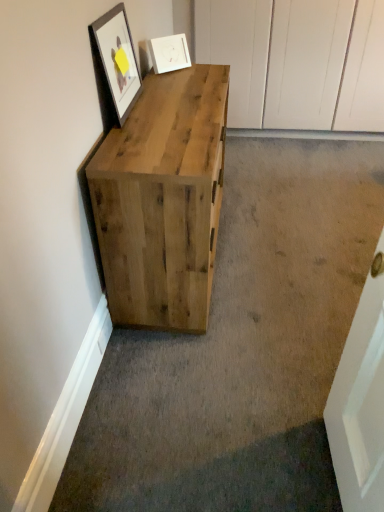
What do you see at coordinates (163, 200) in the screenshot? This screenshot has width=384, height=512. I see `natural wood chest of drawers at left` at bounding box center [163, 200].

Describe the element at coordinates (168, 53) in the screenshot. The height and width of the screenshot is (512, 384). I see `white matte picture frame at upper center, arranged as the second picture frame when viewed from the left` at that location.

At what (x,y) coordinates should I click in order to perform the action: click on white matte picture frame at upper center, the second picture frame when ordered from front to back. Please return your answer as a coordinate pair (x, y). This screenshot has width=384, height=512. Looking at the image, I should click on (168, 53).

Find the location of `natural wood chest of drawers at left`. natural wood chest of drawers at left is located at coordinates (163, 200).

Choose the correct answer: Is matte black frame at upper left, which ranks as the 2th picture frame in back-to-front order, inside white matte picture frame at upper center, the second picture frame when ordered from front to back, or outside it?

matte black frame at upper left, which ranks as the 2th picture frame in back-to-front order, is outside white matte picture frame at upper center, the second picture frame when ordered from front to back.

Is matte black frame at upper left, which ranks as the 2th picture frame in back-to-front order, positioned behind white matte picture frame at upper center, acting as the first picture frame starting from the back?

That is False.

Can you see matte black frame at upper left, which ranks as the 2th picture frame in back-to-front order, touching white matte picture frame at upper center, arranged as the second picture frame when viewed from the left?

No, matte black frame at upper left, which ranks as the 2th picture frame in back-to-front order, is not in contact with white matte picture frame at upper center, arranged as the second picture frame when viewed from the left.

Identify the location of picture frame above the matte black frame at upper left, which is counted as the first picture frame, starting from the front (from the image's perspective). (168, 53).

Measure the distance from white matte picture frame at upper center, which ranks as the 1th picture frame in right-to-left order, to natural wood chest of drawers at left.

The distance of white matte picture frame at upper center, which ranks as the 1th picture frame in right-to-left order, from natural wood chest of drawers at left is 66.08 centimeters.

Who is bigger, white matte picture frame at upper center, acting as the first picture frame starting from the back, or natural wood chest of drawers at left?

With larger size is natural wood chest of drawers at left.

Is white matte picture frame at upper center, arranged as the second picture frame when viewed from the left, to the left of natural wood chest of drawers at left from the viewer's perspective?

Yes, white matte picture frame at upper center, arranged as the second picture frame when viewed from the left, is to the left of natural wood chest of drawers at left.

Is point (157, 57) positioned in front of point (192, 239)?

No, (157, 57) is further to viewer.

Is matte black frame at upper left, which ranks as the 2th picture frame in back-to-front order, located within white matte picture frame at upper center, arranged as the second picture frame when viewed from the left?

Actually, matte black frame at upper left, which ranks as the 2th picture frame in back-to-front order, is outside white matte picture frame at upper center, arranged as the second picture frame when viewed from the left.

Is white matte picture frame at upper center, which ranks as the 1th picture frame in right-to-left order, with matte black frame at upper left, which ranks as the 2th picture frame in back-to-front order?

No, white matte picture frame at upper center, which ranks as the 1th picture frame in right-to-left order, is not in contact with matte black frame at upper left, which ranks as the 2th picture frame in back-to-front order.

From the image's perspective, is white matte picture frame at upper center, the second picture frame when ordered from front to back, under matte black frame at upper left, which is counted as the first picture frame, starting from the front?

Incorrect, from the image's perspective, white matte picture frame at upper center, the second picture frame when ordered from front to back, is higher than matte black frame at upper left, which is counted as the first picture frame, starting from the front.

Considering the positions of objects natural wood chest of drawers at left and matte black frame at upper left, which ranks as the 2th picture frame in right-to-left order, in the image provided, who is more to the right, natural wood chest of drawers at left or matte black frame at upper left, which ranks as the 2th picture frame in right-to-left order,?

From the viewer's perspective, natural wood chest of drawers at left appears more on the right side.

From a real-world perspective, is natural wood chest of drawers at left positioned above or below matte black frame at upper left, which ranks as the 2th picture frame in right-to-left order?

natural wood chest of drawers at left is below matte black frame at upper left, which ranks as the 2th picture frame in right-to-left order.

Is natural wood chest of drawers at left smaller than matte black frame at upper left, which ranks as the 2th picture frame in back-to-front order?

No.

Would you say matte black frame at upper left, which ranks as the 2th picture frame in back-to-front order, is part of natural wood chest of drawers at left's contents?

Definitely not — matte black frame at upper left, which ranks as the 2th picture frame in back-to-front order, is not inside natural wood chest of drawers at left.

Is matte black frame at upper left, which ranks as the 2th picture frame in back-to-front order, facing away from natural wood chest of drawers at left?

No.

How different are the orientations of matte black frame at upper left, which ranks as the 2th picture frame in right-to-left order, and natural wood chest of drawers at left in degrees?

matte black frame at upper left, which ranks as the 2th picture frame in right-to-left order, and natural wood chest of drawers at left are facing 0.83 degrees away from each other.

Considering the relative sizes of matte black frame at upper left, which ranks as the 2th picture frame in back-to-front order, and natural wood chest of drawers at left in the image provided, is matte black frame at upper left, which ranks as the 2th picture frame in back-to-front order, bigger than natural wood chest of drawers at left?

Incorrect, matte black frame at upper left, which ranks as the 2th picture frame in back-to-front order, is not larger than natural wood chest of drawers at left.

Is matte black frame at upper left, which ranks as the 2th picture frame in right-to-left order, completely or partially outside of natural wood chest of drawers at left?

Yes, matte black frame at upper left, which ranks as the 2th picture frame in right-to-left order, is located beyond the bounds of natural wood chest of drawers at left.

Measure the distance between natural wood chest of drawers at left and white matte picture frame at upper center, the second picture frame when ordered from front to back.

natural wood chest of drawers at left is 26.02 inches from white matte picture frame at upper center, the second picture frame when ordered from front to back.

From the image's perspective, is natural wood chest of drawers at left on top of white matte picture frame at upper center, the second picture frame when ordered from front to back?

No, from the image's perspective, natural wood chest of drawers at left is not on top of white matte picture frame at upper center, the second picture frame when ordered from front to back.

Which is in front, natural wood chest of drawers at left or white matte picture frame at upper center, the second picture frame when ordered from front to back?

natural wood chest of drawers at left is in front.

Considering the sizes of objects natural wood chest of drawers at left and white matte picture frame at upper center, acting as the first picture frame starting from the back, in the image provided, who is smaller, natural wood chest of drawers at left or white matte picture frame at upper center, acting as the first picture frame starting from the back,?

With smaller size is white matte picture frame at upper center, acting as the first picture frame starting from the back.

The image size is (384, 512). Identify the location of picture frame that is above the white matte picture frame at upper center, the second picture frame when ordered from front to back (from a real-world perspective). (117, 60).

Locate an element on the screen. Image resolution: width=384 pixels, height=512 pixels. picture frame that is the 1st object to the left of the natural wood chest of drawers at left, starting at the anchor is located at coordinates (168, 53).

Considering their positions, is natural wood chest of drawers at left positioned closer to matte black frame at upper left, which appears as the 1th picture frame when viewed from the left, than white matte picture frame at upper center, arranged as the second picture frame when viewed from the left?

natural wood chest of drawers at left is closer to matte black frame at upper left, which appears as the 1th picture frame when viewed from the left.

Which object lies further to the anchor point white matte picture frame at upper center, which ranks as the 1th picture frame in right-to-left order, natural wood chest of drawers at left or matte black frame at upper left, which is counted as the first picture frame, starting from the front?

Based on the image, natural wood chest of drawers at left appears to be further to white matte picture frame at upper center, which ranks as the 1th picture frame in right-to-left order.

Considering their positions, is matte black frame at upper left, which ranks as the 2th picture frame in back-to-front order, positioned closer to natural wood chest of drawers at left than white matte picture frame at upper center, the second picture frame when ordered from front to back?

matte black frame at upper left, which ranks as the 2th picture frame in back-to-front order.

Which object lies further to the anchor point natural wood chest of drawers at left, white matte picture frame at upper center, acting as the first picture frame starting from the back, or matte black frame at upper left, which appears as the 1th picture frame when viewed from the left?

white matte picture frame at upper center, acting as the first picture frame starting from the back.

Considering their positions, is white matte picture frame at upper center, arranged as the second picture frame when viewed from the left, positioned further to matte black frame at upper left, which appears as the 1th picture frame when viewed from the left, than natural wood chest of drawers at left?

The object further to matte black frame at upper left, which appears as the 1th picture frame when viewed from the left, is white matte picture frame at upper center, arranged as the second picture frame when viewed from the left.

Estimate the real-world distances between objects in this image. Which object is closer to white matte picture frame at upper center, the second picture frame when ordered from front to back, matte black frame at upper left, which ranks as the 2th picture frame in back-to-front order, or natural wood chest of drawers at left?

matte black frame at upper left, which ranks as the 2th picture frame in back-to-front order.

Locate an element on the screen. picture frame between natural wood chest of drawers at left and white matte picture frame at upper center, acting as the first picture frame starting from the back, from front to back is located at coordinates (117, 60).